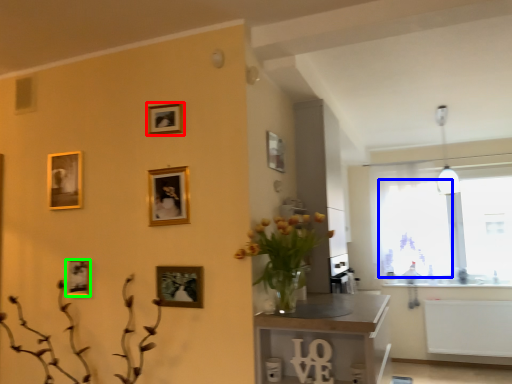
Question: Which is nearer to the picture frame (highlighted by a red box)? window screen (highlighted by a blue box) or picture frame (highlighted by a green box).

Choices:
 (A) window screen
 (B) picture frame

Answer: (B)